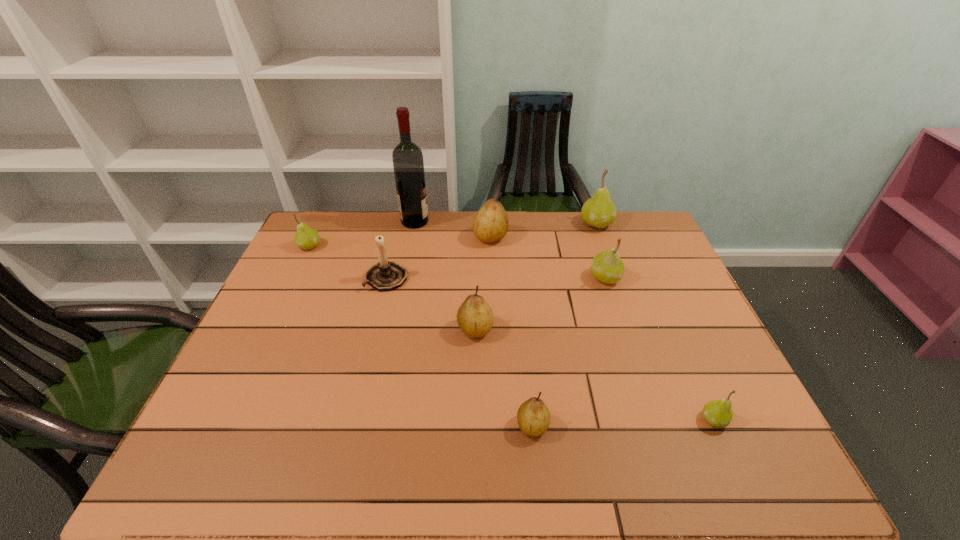
I want to click on vacant area located 0.240m on the front of the second smallest brown pear, so click(x=474, y=428).

This screenshot has height=540, width=960. Identify the location of vacant region located on the front of the leftmost pear. (296, 275).

Where is `vacant space located 0.240m on the right of the smallest brown pear`? vacant space located 0.240m on the right of the smallest brown pear is located at coordinates (658, 426).

This screenshot has width=960, height=540. Find the location of `vacant area situated on the back of the rightmost pear`. vacant area situated on the back of the rightmost pear is located at coordinates (672, 324).

The height and width of the screenshot is (540, 960). Find the location of `alcohol positioned at the far edge`. alcohol positioned at the far edge is located at coordinates (408, 164).

Identify the location of object positioned at the near edge. This screenshot has width=960, height=540. (533, 416).

In order to click on object located in the left edge section of the desktop in this screenshot , I will do coord(306,238).

Locate an element on the screen. This screenshot has width=960, height=540. object that is at the far left corner is located at coordinates [x=306, y=238].

I want to click on object that is positioned at the far right corner, so pos(599,211).

Identify the location of blank space at the far edge of the desktop. (456, 229).